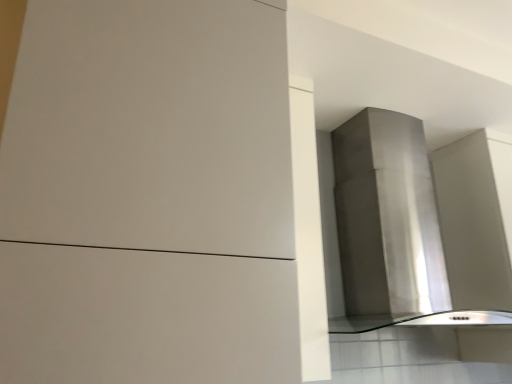
Question: Is stainless steel vent at upper right outside of matte white cabinet at center?

Choices:
 (A) yes
 (B) no

Answer: (A)

Question: From a real-world perspective, is stainless steel vent at upper right located higher than matte white cabinet at center?

Choices:
 (A) yes
 (B) no

Answer: (A)

Question: Is stainless steel vent at upper right closer to camera compared to matte white cabinet at center?

Choices:
 (A) yes
 (B) no

Answer: (B)

Question: Is stainless steel vent at upper right bigger than matte white cabinet at center?

Choices:
 (A) no
 (B) yes

Answer: (A)

Question: Does stainless steel vent at upper right have a lesser height compared to matte white cabinet at center?

Choices:
 (A) yes
 (B) no

Answer: (A)

Question: From the image's perspective, is stainless steel vent at upper right under matte white cabinet at center?

Choices:
 (A) yes
 (B) no

Answer: (A)

Question: Does matte white cabinet at center have a lesser height compared to stainless steel vent at upper right?

Choices:
 (A) yes
 (B) no

Answer: (B)

Question: From the image's perspective, is matte white cabinet at center located beneath stainless steel vent at upper right?

Choices:
 (A) no
 (B) yes

Answer: (A)

Question: Is matte white cabinet at center at the right side of stainless steel vent at upper right?

Choices:
 (A) yes
 (B) no

Answer: (B)

Question: Does matte white cabinet at center have a smaller size compared to stainless steel vent at upper right?

Choices:
 (A) yes
 (B) no

Answer: (B)

Question: Is matte white cabinet at center turned away from stainless steel vent at upper right?

Choices:
 (A) yes
 (B) no

Answer: (B)

Question: Could you tell me if matte white cabinet at center is turned towards stainless steel vent at upper right?

Choices:
 (A) no
 (B) yes

Answer: (A)

Question: Would you say matte white cabinet at center is inside or outside stainless steel vent at upper right?

Choices:
 (A) inside
 (B) outside

Answer: (B)